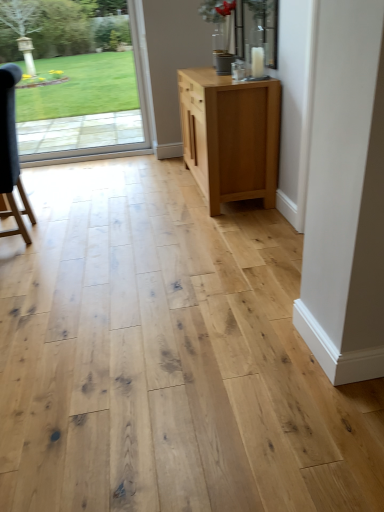
Question: Can you confirm if natural wood cabinet at center is wider than transparent glass door at upper left?

Choices:
 (A) yes
 (B) no

Answer: (A)

Question: Is natural wood cabinet at center to the right of transparent glass door at upper left from the viewer's perspective?

Choices:
 (A) yes
 (B) no

Answer: (A)

Question: Does natural wood cabinet at center have a greater height compared to transparent glass door at upper left?

Choices:
 (A) yes
 (B) no

Answer: (B)

Question: Is the depth of natural wood cabinet at center less than that of transparent glass door at upper left?

Choices:
 (A) no
 (B) yes

Answer: (B)

Question: From a real-world perspective, is natural wood cabinet at center located beneath transparent glass door at upper left?

Choices:
 (A) no
 (B) yes

Answer: (B)

Question: Does natural wood cabinet at center lie behind transparent glass door at upper left?

Choices:
 (A) yes
 (B) no

Answer: (B)

Question: Is there a large distance between dark gray fabric chair at left and transparent glass door at upper left?

Choices:
 (A) no
 (B) yes

Answer: (B)

Question: Is dark gray fabric chair at left wider than transparent glass door at upper left?

Choices:
 (A) no
 (B) yes

Answer: (B)

Question: Is dark gray fabric chair at left to the right of transparent glass door at upper left from the viewer's perspective?

Choices:
 (A) yes
 (B) no

Answer: (B)

Question: Does dark gray fabric chair at left appear on the left side of transparent glass door at upper left?

Choices:
 (A) yes
 (B) no

Answer: (A)

Question: Can you confirm if dark gray fabric chair at left is bigger than transparent glass door at upper left?

Choices:
 (A) no
 (B) yes

Answer: (B)

Question: Does dark gray fabric chair at left have a lesser height compared to transparent glass door at upper left?

Choices:
 (A) no
 (B) yes

Answer: (B)

Question: Considering the relative sizes of natural wood cabinet at center and dark gray fabric chair at left in the image provided, is natural wood cabinet at center bigger than dark gray fabric chair at left?

Choices:
 (A) no
 (B) yes

Answer: (B)